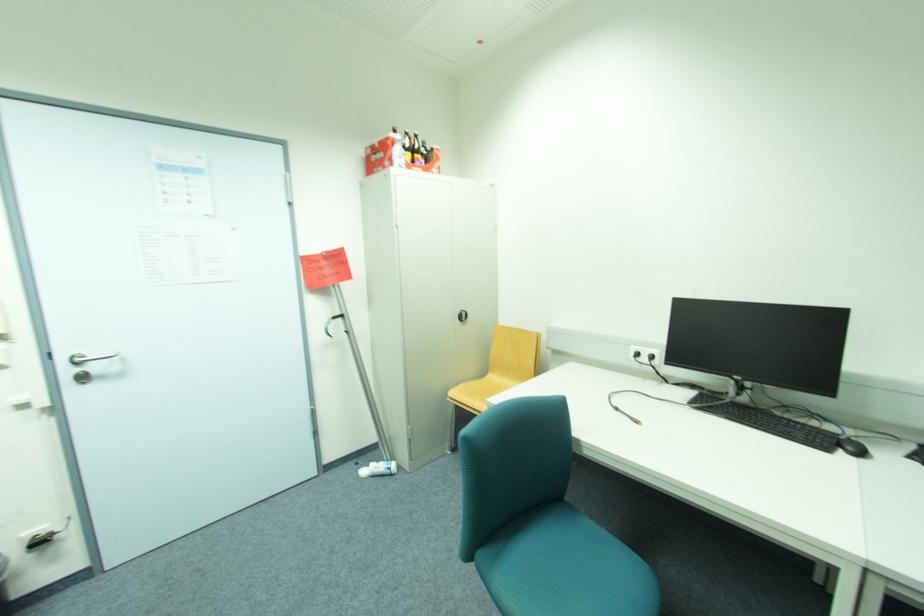
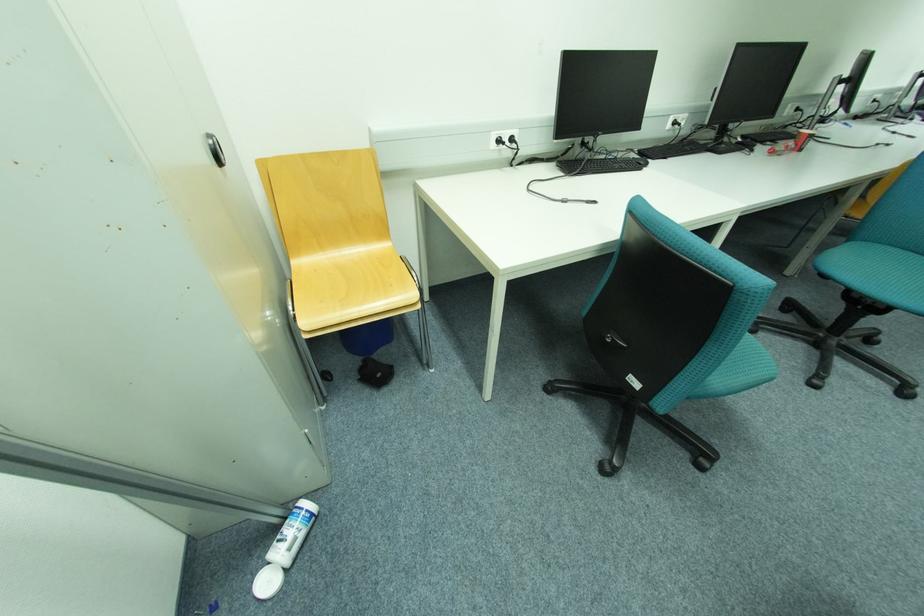
Where in the second image is the point corresponding to (x=390, y=461) from the first image?

(287, 525)